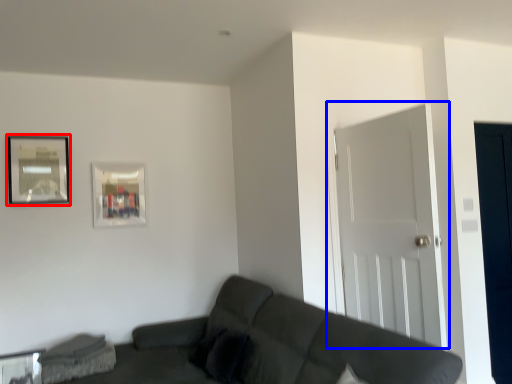
Question: Among these objects, which one is farthest to the camera, picture frame (highlighted by a red box) or door (highlighted by a blue box)?

Choices:
 (A) picture frame
 (B) door

Answer: (A)